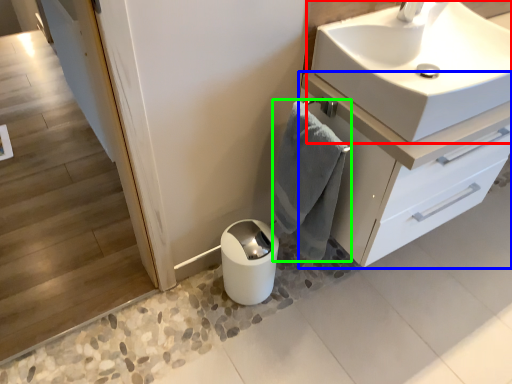
Question: Which is farther away from sink (highlighted by a red box)? bathroom cabinet (highlighted by a blue box) or bath towel (highlighted by a green box)?

Choices:
 (A) bathroom cabinet
 (B) bath towel

Answer: (B)